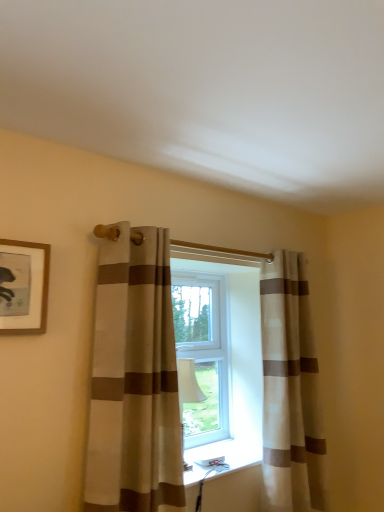
Question: Considering the positions of point (36, 309) and point (107, 461), is point (36, 309) closer or farther from the camera than point (107, 461)?

Choices:
 (A) closer
 (B) farther

Answer: (B)

Question: From their relative heights in the image, would you say wooden-framed picture at upper left is taller or shorter than beige striped curtain at center, which is the 2th curtain from right to left?

Choices:
 (A) tall
 (B) short

Answer: (B)

Question: Estimate the real-world distances between objects in this image. Which object is farther from the wooden-framed picture at upper left?

Choices:
 (A) beige striped curtain at center, which is the 1th curtain in right-to-left order
 (B) beige striped curtain at center, placed as the 1th curtain when sorted from front to back

Answer: (A)

Question: Considering the real-world distances, which object is farthest from the wooden-framed picture at upper left?

Choices:
 (A) beige striped curtain at center, which is the 1th curtain in right-to-left order
 (B) beige striped curtain at center, placed as the 1th curtain when sorted from front to back

Answer: (A)